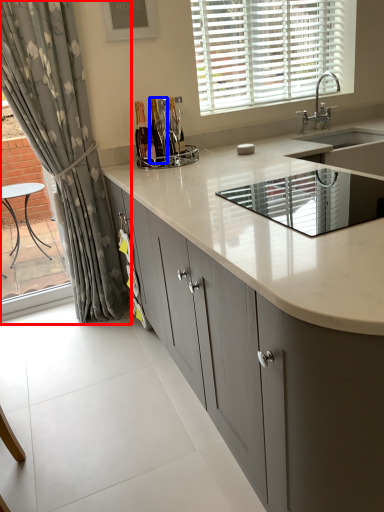
Question: Which object appears closest to the camera in this image, curtain (highlighted by a red box) or bottle (highlighted by a blue box)?

Choices:
 (A) curtain
 (B) bottle

Answer: (A)